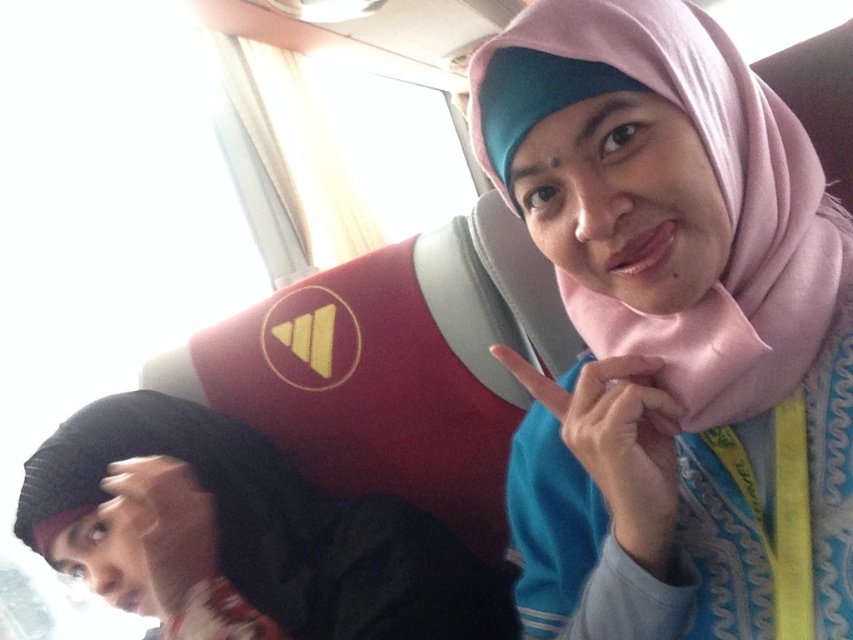
Which is in front, point (773, 467) or point (126, 497)?

Point (773, 467)

Between pink fabric hijab at upper right and black fabric at lower left, which one has less height?

With less height is black fabric at lower left.

What do you see at coordinates (672, 332) in the screenshot? I see `pink fabric hijab at upper right` at bounding box center [672, 332].

This screenshot has width=853, height=640. Identify the location of pink fabric hijab at upper right. (672, 332).